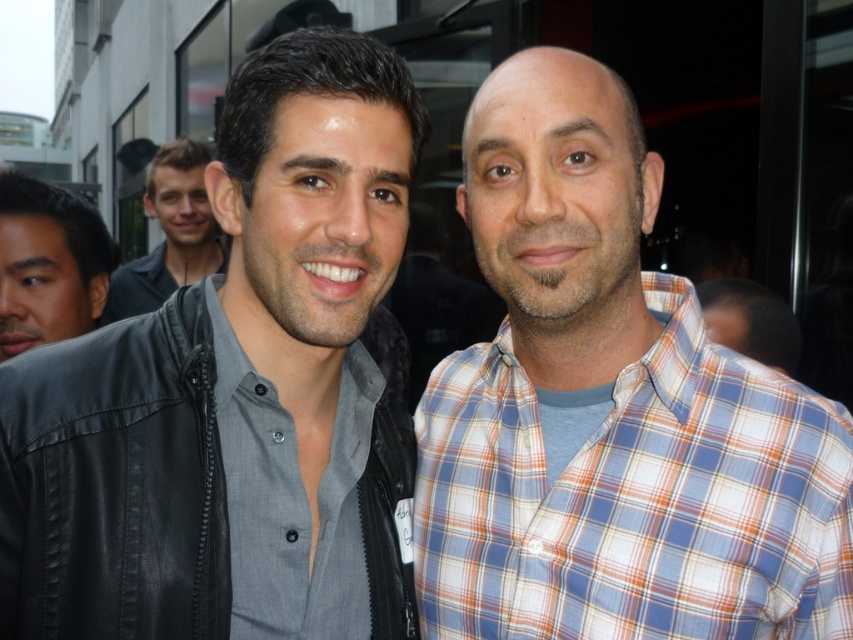
From the picture: Which of these two, gray matte shirt at center or matte black jacket at left, stands taller?

Standing taller between the two is matte black jacket at left.

Is gray matte shirt at center shorter than matte black jacket at left?

Correct, gray matte shirt at center is not as tall as matte black jacket at left.

The image size is (853, 640). What do you see at coordinates (291, 499) in the screenshot? I see `gray matte shirt at center` at bounding box center [291, 499].

Locate an element on the screen. gray matte shirt at center is located at coordinates (291, 499).

Is blue plaid shirt at right thinner than gray matte shirt at center?

No, blue plaid shirt at right is not thinner than gray matte shirt at center.

Which is more to the left, blue plaid shirt at right or gray matte shirt at center?

From the viewer's perspective, gray matte shirt at center appears more on the left side.

Which is in front, point (575, 493) or point (248, 483)?

Point (248, 483) is in front.

Find the location of `blue plaid shirt at right`. blue plaid shirt at right is located at coordinates (635, 499).

Who is taller, matte black jacket at left or matte black jacket at upper left?

matte black jacket at upper left

Between point (38, 337) and point (189, 180), which one is positioned behind?

Point (189, 180)

Describe the element at coordinates (48, 262) in the screenshot. The image size is (853, 640). I see `matte black jacket at left` at that location.

Image resolution: width=853 pixels, height=640 pixels. In order to click on matte black jacket at left in this screenshot , I will do `click(48, 262)`.